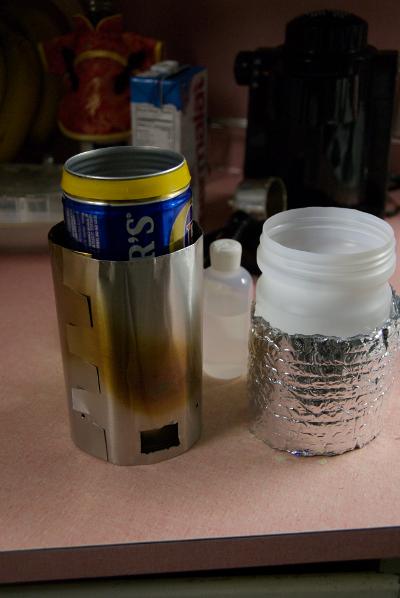
What are the coordinates of `plastic cup` in the screenshot? It's located at (318, 299).